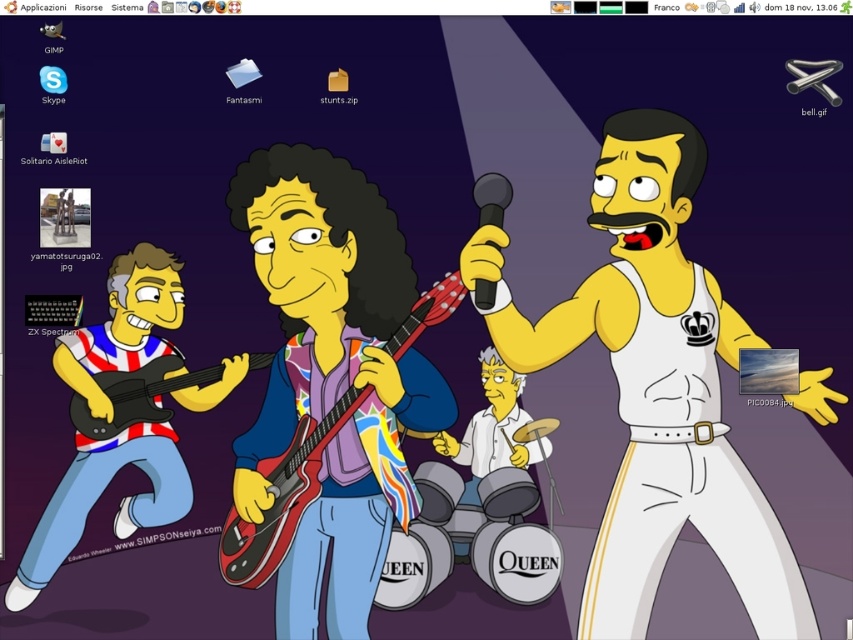
You are a virtual assistant trying to determine the spatial arrangement of objects on a desktop background. You see a striped fabric guitar at left and a black matte microphone at upper center. Which object is closer to the front of the scene?

The striped fabric guitar at left is closer to the front of the scene because the black matte microphone at upper center is behind it.

Which object is wider, the striped fabric guitar at left or the black matte microphone at upper center?

The striped fabric guitar at left is wider than the black matte microphone at upper center according to the description.